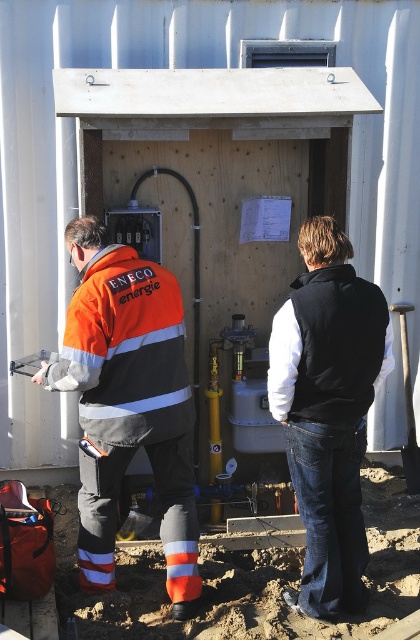
Question: Which object appears closest to the camera in this image?

Choices:
 (A) orange reflective jacket at center
 (B) black fleece vest at center

Answer: (B)

Question: Does orange reflective jacket at center have a smaller size compared to black fleece vest at center?

Choices:
 (A) no
 (B) yes

Answer: (A)

Question: Does orange reflective jacket at center lie in front of black fleece vest at center?

Choices:
 (A) no
 (B) yes

Answer: (A)

Question: Which object appears closest to the camera in this image?

Choices:
 (A) black fleece vest at center
 (B) orange reflective jacket at center

Answer: (A)

Question: Is orange reflective jacket at center behind black fleece vest at center?

Choices:
 (A) yes
 (B) no

Answer: (A)